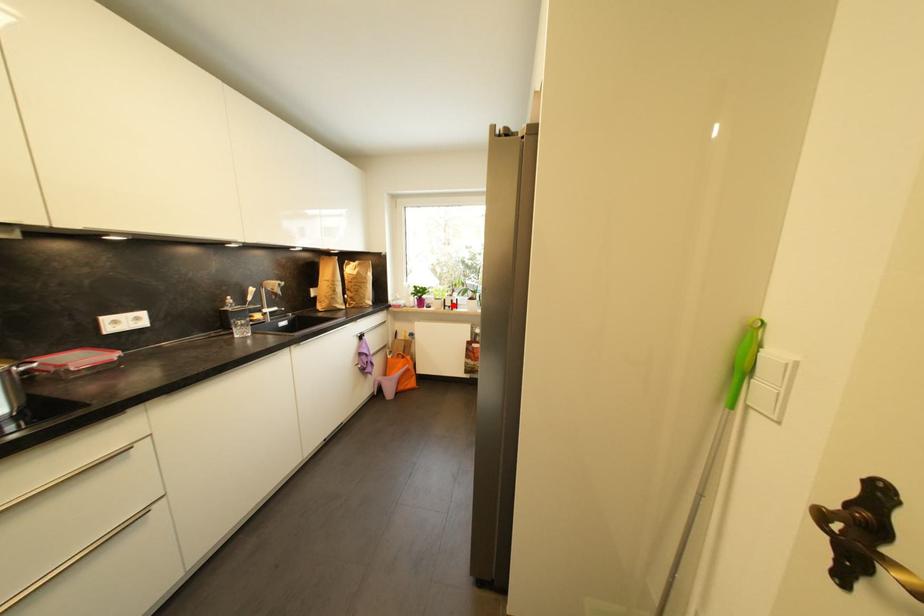
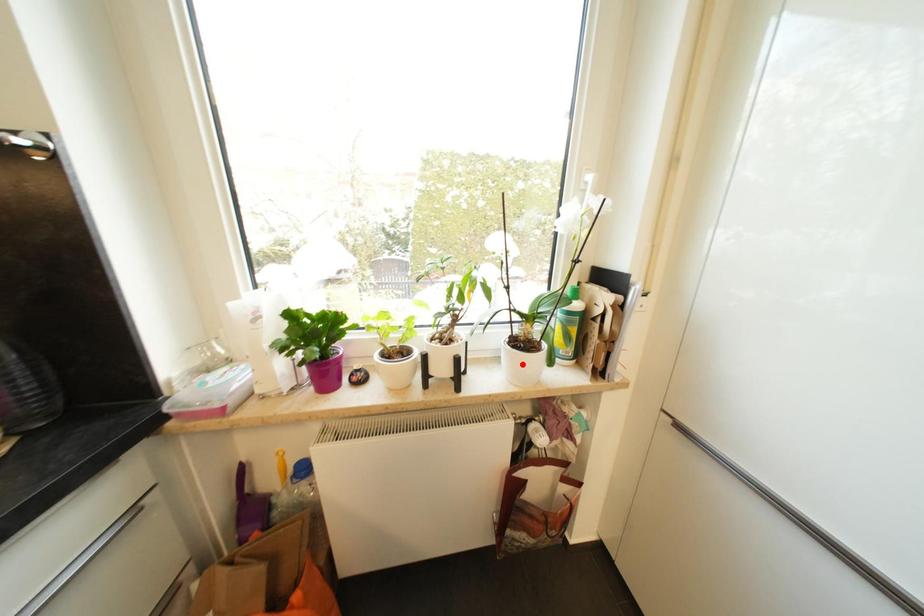
I am providing you with two images of the same scene from different viewpoints. A red point is marked on the first image and another point is marked on the second image. Is the marked point in image1 the same physical position as the marked point in image2?

No